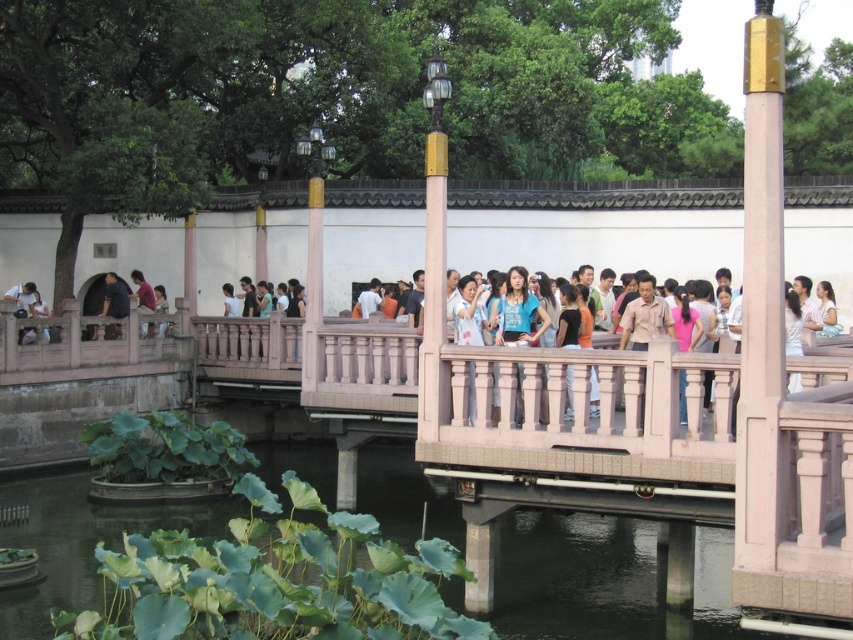
Question: Can you confirm if dark gray shirt at left is wider than matte pink shirt at center?

Choices:
 (A) yes
 (B) no

Answer: (A)

Question: Which of the following is the closest to the observer?

Choices:
 (A) (143, 291)
 (B) (158, 285)

Answer: (A)

Question: Among these objects, which one is nearest to the camera?

Choices:
 (A) matte pink shirt at center
 (B) light blue denim jeans at lower left
 (C) dark gray shirt at left

Answer: (C)

Question: Which is nearer to the matte pink shirt at center?

Choices:
 (A) light blue denim jeans at lower left
 (B) dark gray shirt at left

Answer: (A)

Question: Is dark gray shirt at left in front of light blue denim jeans at lower left?

Choices:
 (A) yes
 (B) no

Answer: (A)

Question: Is dark gray shirt at left to the left of matte pink shirt at center from the viewer's perspective?

Choices:
 (A) no
 (B) yes

Answer: (B)